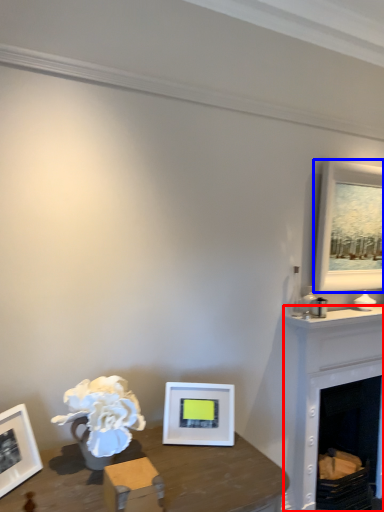
Question: Which of the following is the farthest to the observer, fireplace (highlighted by a red box) or picture frame (highlighted by a blue box)?

Choices:
 (A) fireplace
 (B) picture frame

Answer: (B)